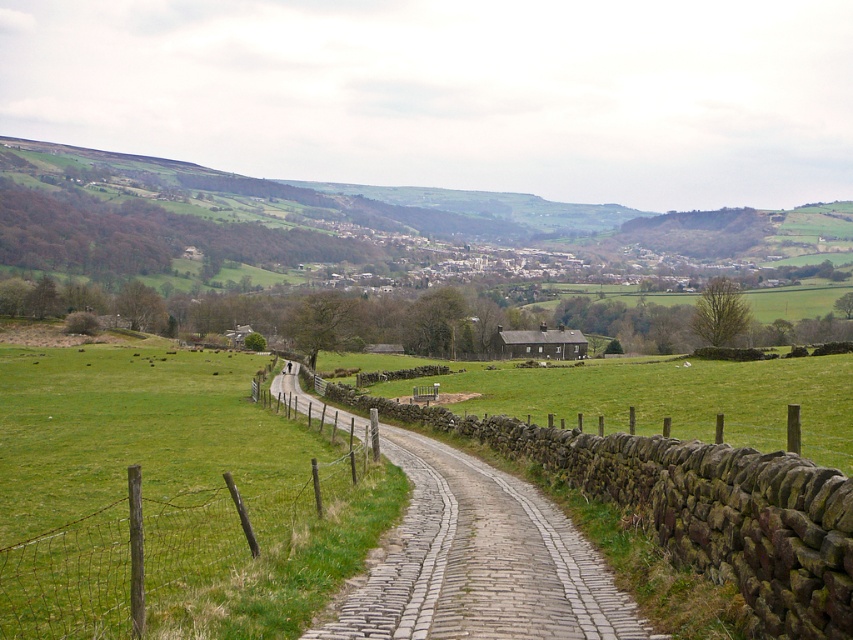
Can you confirm if cobblestone path at center is smaller than wire mesh fence at lower left?

Correct, cobblestone path at center occupies less space than wire mesh fence at lower left.

Does cobblestone path at center lie behind wire mesh fence at lower left?

That is True.

Does point (491, 488) lie in front of point (189, 528)?

No, it is not.

Where is `cobblestone path at center`? This screenshot has width=853, height=640. cobblestone path at center is located at coordinates (480, 561).